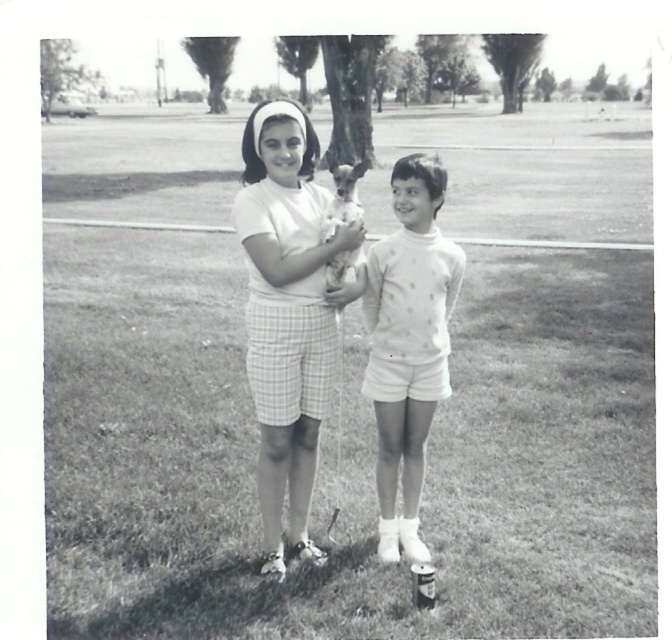
Question: Is white plaid shorts at center to the left of white dotted sweater at center from the viewer's perspective?

Choices:
 (A) no
 (B) yes

Answer: (B)

Question: Which of the following is the closest to the observer?

Choices:
 (A) (282, 474)
 (B) (378, 244)

Answer: (A)

Question: Which object is closer to the camera taking this photo?

Choices:
 (A) white plaid shorts at center
 (B) white dotted sweater at center

Answer: (A)

Question: Is white plaid shorts at center further to the viewer compared to white dotted sweater at center?

Choices:
 (A) no
 (B) yes

Answer: (A)

Question: Does white plaid shorts at center appear on the left side of white dotted sweater at center?

Choices:
 (A) no
 (B) yes

Answer: (B)